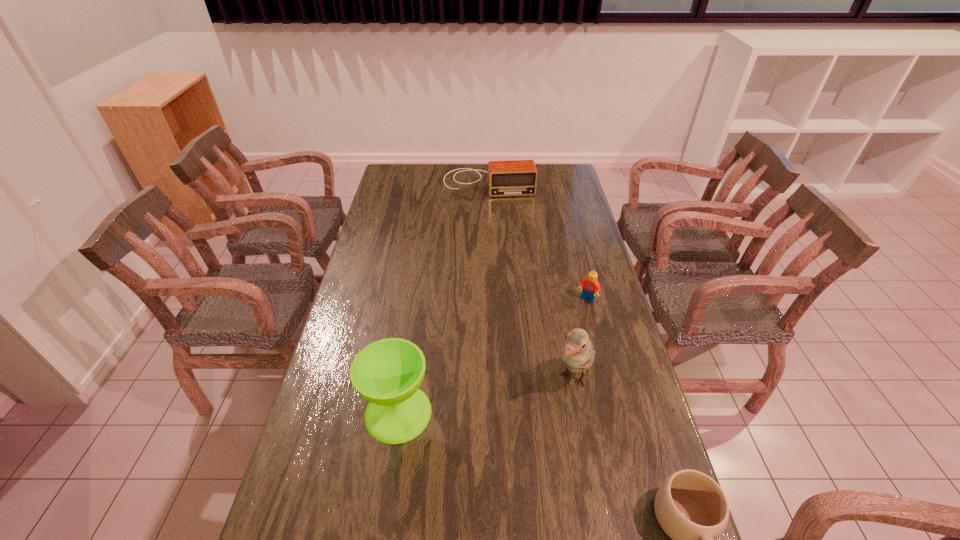
Locate an element on the screen. The width and height of the screenshot is (960, 540). object that is the second closest to the fourth nearest object is located at coordinates [x=387, y=373].

The height and width of the screenshot is (540, 960). Find the location of `object that stands as the second closest to the Lego`. object that stands as the second closest to the Lego is located at coordinates (387, 373).

The image size is (960, 540). Find the location of `vacant area in the image that satisfies the following two spatial constraints: 1. on the front side of the farthest object; 2. on the left side of the bird`. vacant area in the image that satisfies the following two spatial constraints: 1. on the front side of the farthest object; 2. on the left side of the bird is located at coordinates (493, 379).